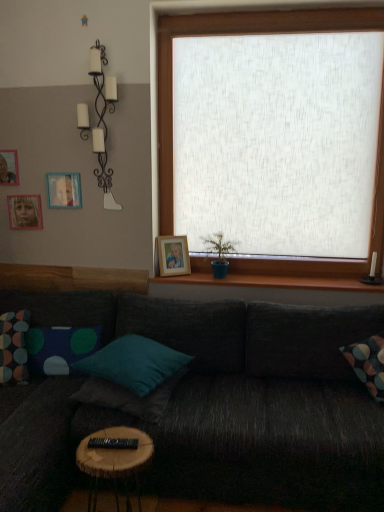
Question: Does teal fabric pillow at center, which ranks as the second pillow in right-to-left order, appear on the right side of wooden round table at lower center?

Choices:
 (A) no
 (B) yes

Answer: (A)

Question: Is teal fabric pillow at center, which ranks as the second pillow in right-to-left order, wider than wooden round table at lower center?

Choices:
 (A) no
 (B) yes

Answer: (B)

Question: Is wooden round table at lower center a part of teal fabric pillow at center, the third pillow from the left?

Choices:
 (A) yes
 (B) no

Answer: (B)

Question: Can you confirm if teal fabric pillow at center, the third pillow from the left, is taller than wooden round table at lower center?

Choices:
 (A) yes
 (B) no

Answer: (B)

Question: Is teal fabric pillow at center, which ranks as the second pillow in right-to-left order, facing away from wooden round table at lower center?

Choices:
 (A) no
 (B) yes

Answer: (A)

Question: Considering the positions of wooden picture frame at upper left, which is the third picture frame from left to right, and polka dot fabric pillow at left, which ranks as the third pillow in right-to-left order, in the image, is wooden picture frame at upper left, which is the third picture frame from left to right, wider or thinner than polka dot fabric pillow at left, which ranks as the third pillow in right-to-left order,?

Choices:
 (A) thin
 (B) wide

Answer: (A)

Question: Is point (66, 192) positioned closer to the camera than point (26, 347)?

Choices:
 (A) closer
 (B) farther

Answer: (B)

Question: From a real-world perspective, is wooden picture frame at upper left, which is counted as the third picture frame, starting from the bottom, above or below polka dot fabric pillow at left, which ranks as the third pillow in right-to-left order?

Choices:
 (A) below
 (B) above

Answer: (B)

Question: From the image's perspective, is wooden picture frame at upper left, which is counted as the third picture frame, starting from the bottom, located above or below polka dot fabric pillow at left, which ranks as the third pillow in right-to-left order?

Choices:
 (A) below
 (B) above

Answer: (B)

Question: From the image's perspective, is teal fabric pillow at center, the third pillow from the left, above or below wooden picture frame at upper left, which is the fourth picture frame in bottom-to-top order?

Choices:
 (A) below
 (B) above

Answer: (A)

Question: Is teal fabric pillow at center, which ranks as the second pillow in right-to-left order, wider or thinner than wooden picture frame at upper left, marked as the 1th picture frame in a left-to-right arrangement?

Choices:
 (A) wide
 (B) thin

Answer: (A)

Question: Relative to wooden picture frame at upper left, placed as the fourth picture frame when sorted from right to left, is teal fabric pillow at center, which ranks as the second pillow in right-to-left order, in front or behind?

Choices:
 (A) front
 (B) behind

Answer: (A)

Question: Considering the positions of teal fabric pillow at center, the third pillow from the left, and wooden picture frame at upper left, marked as the 1th picture frame in a left-to-right arrangement, in the image, is teal fabric pillow at center, the third pillow from the left, bigger or smaller than wooden picture frame at upper left, marked as the 1th picture frame in a left-to-right arrangement,?

Choices:
 (A) big
 (B) small

Answer: (A)

Question: Considering the positions of dark gray fabric couch at center and white matte candle holder at upper left in the image, is dark gray fabric couch at center taller or shorter than white matte candle holder at upper left?

Choices:
 (A) tall
 (B) short

Answer: (B)

Question: In terms of width, does dark gray fabric couch at center look wider or thinner when compared to white matte candle holder at upper left?

Choices:
 (A) thin
 (B) wide

Answer: (B)